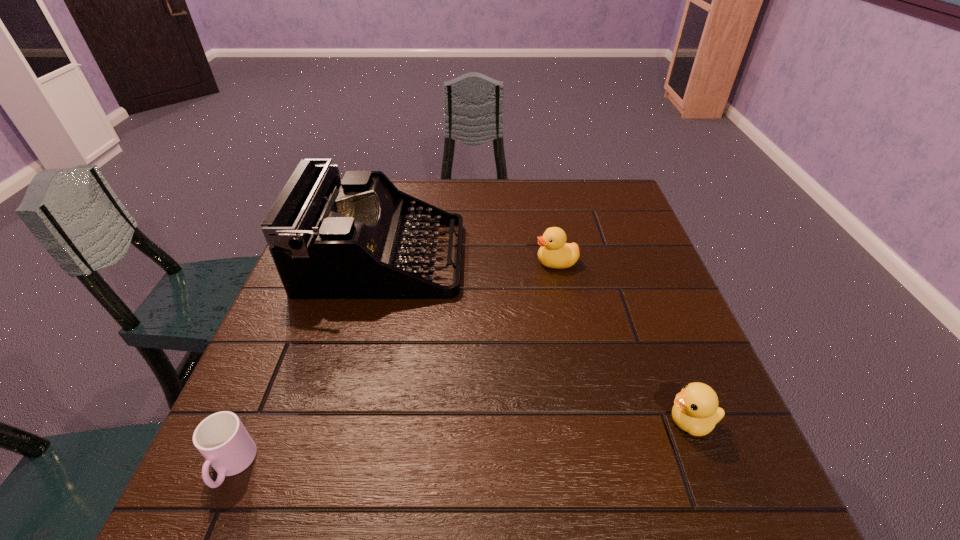
Where is `typewriter`? This screenshot has width=960, height=540. typewriter is located at coordinates (329, 239).

Identify the location of the third object from left to right. The image size is (960, 540). click(554, 252).

Where is `the left duck`? This screenshot has height=540, width=960. the left duck is located at coordinates (554, 252).

In order to click on the right duck in this screenshot , I will do pyautogui.click(x=695, y=410).

The width and height of the screenshot is (960, 540). Find the location of `the nearer duck`. the nearer duck is located at coordinates (695, 410).

The height and width of the screenshot is (540, 960). Identify the location of cup. (222, 439).

Image resolution: width=960 pixels, height=540 pixels. What are the coordinates of `vacant space situated 0.230m on the typing side of the typewriter` in the screenshot? It's located at (x=549, y=259).

Find the location of a particular element. The image size is (960, 540). vacant region located at the beak of the farther duck is located at coordinates (465, 262).

At what (x,y) coordinates should I click in order to perform the action: click on vacant area situated at the beak of the farther duck. Please return your answer as a coordinate pair (x, y). The width and height of the screenshot is (960, 540). Looking at the image, I should click on (411, 262).

At what (x,y) coordinates should I click in order to perform the action: click on vacant space situated 0.370m at the beak of the farther duck. Please return your answer as a coordinate pair (x, y). This screenshot has width=960, height=540. Looking at the image, I should click on (392, 262).